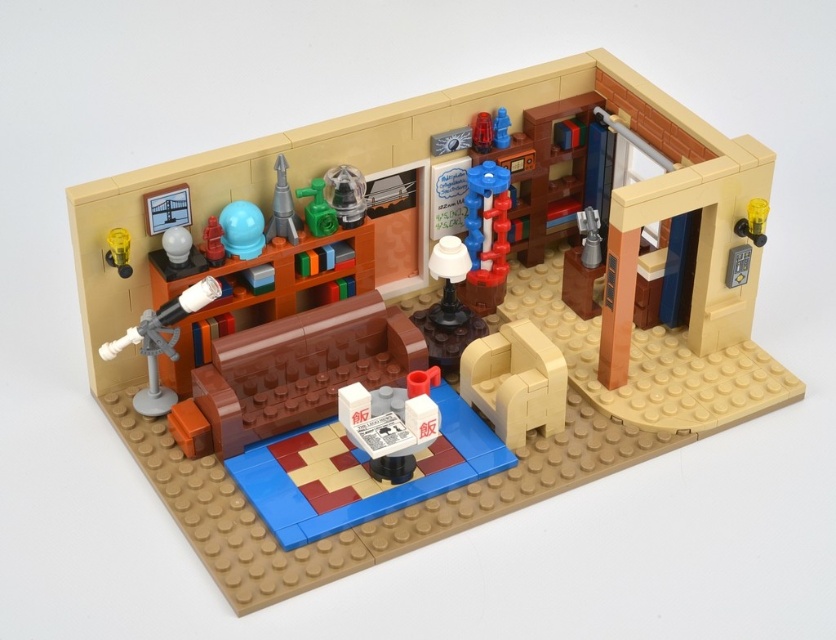
Can you confirm if shiny plastic tower at center is wider than yellow plastic lamp at left?

Yes, shiny plastic tower at center is wider than yellow plastic lamp at left.

Does shiny plastic tower at center have a greater height compared to yellow plastic lamp at left?

Yes, shiny plastic tower at center is taller than yellow plastic lamp at left.

Is point (470, 244) positioned after point (115, 227)?

That is True.

This screenshot has height=640, width=836. Identify the location of shiny plastic tower at center. (487, 236).

Who is positioned more to the left, shiny plastic tower at center or translucent red lamp at upper center?

translucent red lamp at upper center

Is shiny plastic tower at center bigger than translucent red lamp at upper center?

Indeed, shiny plastic tower at center has a larger size compared to translucent red lamp at upper center.

Measure the distance between shiny plastic tower at center and camera.

They are 1.35 meters apart.

This screenshot has width=836, height=640. I want to click on shiny plastic tower at center, so click(x=487, y=236).

Does white glossy cup at center appear on the right side of green plastic rocket at center?

Yes, white glossy cup at center is to the right of green plastic rocket at center.

Does white glossy cup at center have a larger size compared to green plastic rocket at center?

Yes.

Where is `white glossy cup at center`? The height and width of the screenshot is (640, 836). white glossy cup at center is located at coordinates (391, 422).